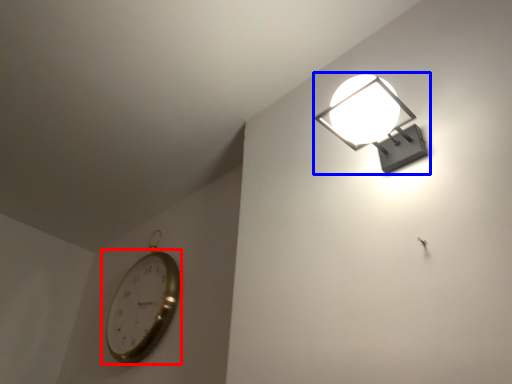
Question: Which object is closer to the camera taking this photo, wall clock (highlighted by a red box) or lamp (highlighted by a blue box)?

Choices:
 (A) wall clock
 (B) lamp

Answer: (B)